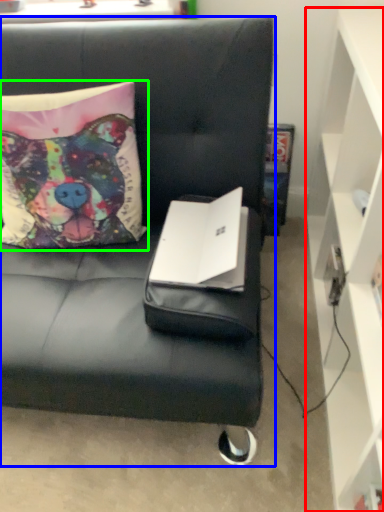
Question: Estimate the real-world distances between objects in this image. Which object is farther from cabinetry (highlighted by a red box), studio couch (highlighted by a blue box) or pillow (highlighted by a green box)?

Choices:
 (A) studio couch
 (B) pillow

Answer: (B)